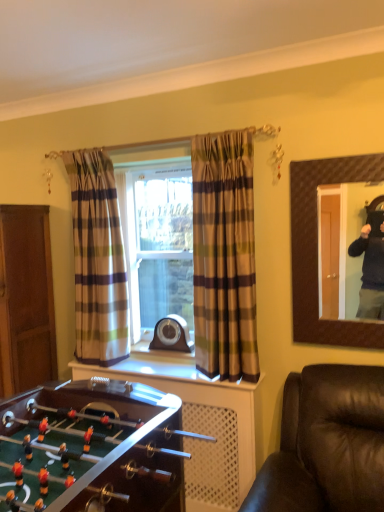
Identify the location of empty space that is ontop of brown textured mirror at upper right (from a real-world perspective). (338, 157).